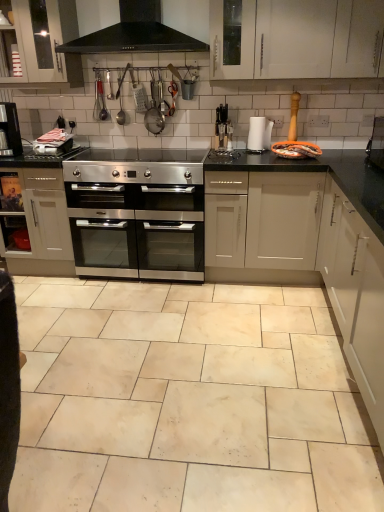
Image resolution: width=384 pixels, height=512 pixels. I want to click on free space above beige marble tile at center (from a real-world perspective), so click(x=155, y=345).